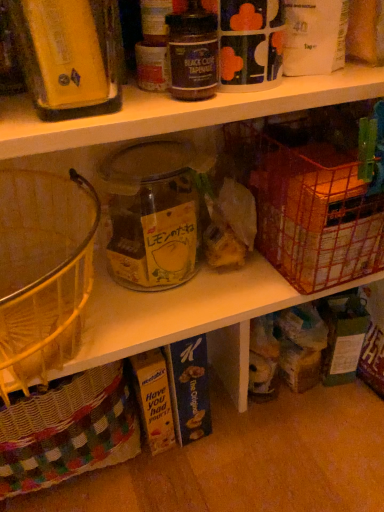
Question: Considering the relative sizes of black glass jar at upper center, which ranks as the 2th bottle in left-to-right order, and transparent glass jar at center in the image provided, is black glass jar at upper center, which ranks as the 2th bottle in left-to-right order, wider than transparent glass jar at center?

Choices:
 (A) no
 (B) yes

Answer: (A)

Question: Is black glass jar at upper center, the 1th bottle when ordered from right to left, positioned in front of transparent glass jar at center?

Choices:
 (A) no
 (B) yes

Answer: (B)

Question: Does black glass jar at upper center, which ranks as the 2th bottle in left-to-right order, have a lesser height compared to transparent glass jar at center?

Choices:
 (A) no
 (B) yes

Answer: (B)

Question: Is black glass jar at upper center, the 1th bottle when ordered from right to left, at the right side of transparent glass jar at center?

Choices:
 (A) yes
 (B) no

Answer: (A)

Question: Is transparent glass jar at center completely or partially inside black glass jar at upper center, the 1th bottle when ordered from right to left?

Choices:
 (A) yes
 (B) no

Answer: (B)

Question: Would you consider black glass jar at upper center, which ranks as the 2th bottle in left-to-right order, to be distant from transparent glass jar at center?

Choices:
 (A) yes
 (B) no

Answer: (B)

Question: Can we say matte yellow container at upper left, arranged as the 2th bottle when viewed from the right, lies outside transparent glass jar at center?

Choices:
 (A) no
 (B) yes

Answer: (B)

Question: Does matte yellow container at upper left, arranged as the 2th bottle when viewed from the right, appear on the left side of transparent glass jar at center?

Choices:
 (A) no
 (B) yes

Answer: (B)

Question: Is matte yellow container at upper left, arranged as the 2th bottle when viewed from the right, next to transparent glass jar at center and touching it?

Choices:
 (A) yes
 (B) no

Answer: (B)

Question: Considering the relative positions of matte yellow container at upper left, the 1th bottle from the left, and transparent glass jar at center in the image provided, is matte yellow container at upper left, the 1th bottle from the left, to the right of transparent glass jar at center from the viewer's perspective?

Choices:
 (A) yes
 (B) no

Answer: (B)

Question: Considering the relative sizes of matte yellow container at upper left, arranged as the 2th bottle when viewed from the right, and transparent glass jar at center in the image provided, is matte yellow container at upper left, arranged as the 2th bottle when viewed from the right, smaller than transparent glass jar at center?

Choices:
 (A) yes
 (B) no

Answer: (A)

Question: Is matte yellow container at upper left, the 1th bottle from the left, positioned in front of transparent glass jar at center?

Choices:
 (A) no
 (B) yes

Answer: (B)

Question: Can you confirm if black glass jar at upper center, which ranks as the 2th bottle in left-to-right order, is thinner than metallic wire basket at right?

Choices:
 (A) no
 (B) yes

Answer: (B)